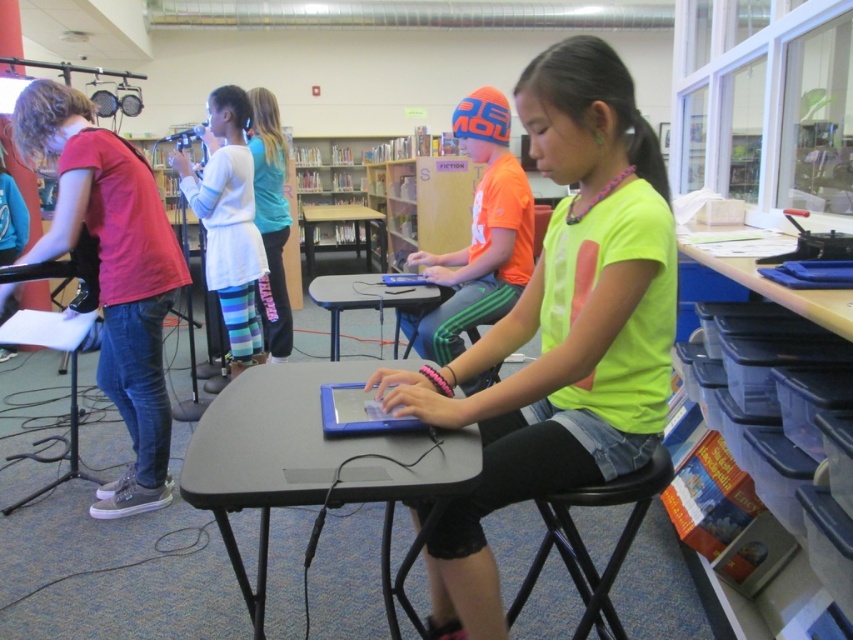
Question: Is neon yellow shirt at center below black plastic stool at center?

Choices:
 (A) yes
 (B) no

Answer: (B)

Question: Estimate the real-world distances between objects in this image. Which object is farther from the matte red shirt at left?

Choices:
 (A) blue matte tablet at center
 (B) orange matte shirt at center
 (C) smooth plastic table at center

Answer: (A)

Question: Which object appears farthest from the camera in this image?

Choices:
 (A) smooth plastic table at center
 (B) neon yellow shirt at center
 (C) orange matte shirt at center

Answer: (A)

Question: Which object is closer to the camera taking this photo?

Choices:
 (A) white cotton hoodie at upper center
 (B) smooth plastic table at center

Answer: (B)

Question: Is black plastic stool at center further to camera compared to white cotton hoodie at upper center?

Choices:
 (A) yes
 (B) no

Answer: (B)

Question: Is neon yellow shirt at center smaller than blue matte tablet at center?

Choices:
 (A) no
 (B) yes

Answer: (A)